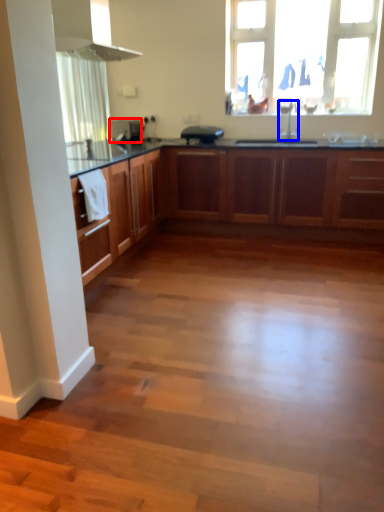
Question: Which object is further to the camera taking this photo, appliance (highlighted by a red box) or tap (highlighted by a blue box)?

Choices:
 (A) appliance
 (B) tap

Answer: (A)